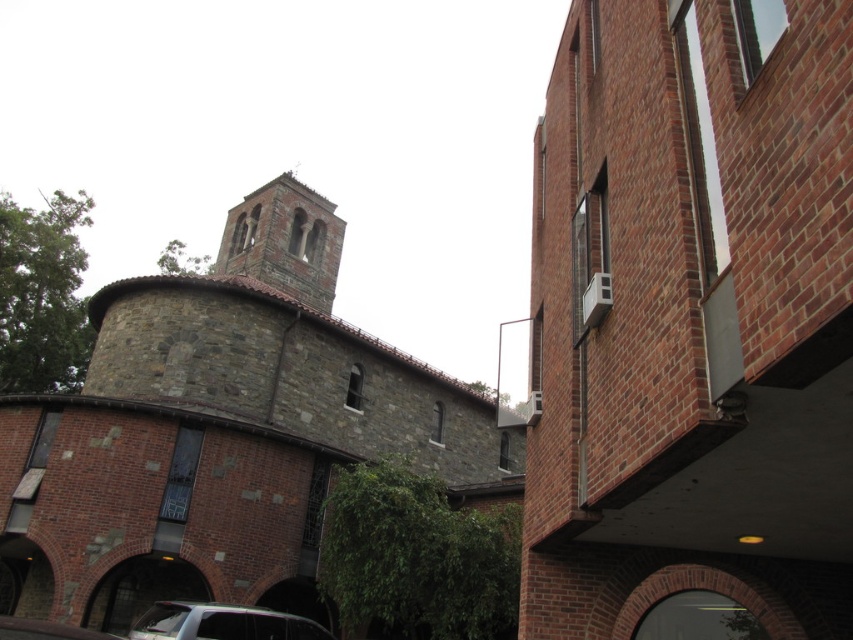
Which is behind, point (746, 429) or point (173, 346)?

The point (173, 346) is behind.

Is brick building at right wider than stone church at center?

In fact, brick building at right might be narrower than stone church at center.

What are the coordinates of `brick building at right` in the screenshot? It's located at (692, 317).

Who is more distant from viewer, (820,474) or (202,632)?

The point (202,632) is more distant.

Can you confirm if brick building at right is positioned above metallic silver car at lower left?

Indeed, brick building at right is positioned over metallic silver car at lower left.

At what (x,y) coordinates should I click in order to perform the action: click on brick building at right. Please return your answer as a coordinate pair (x, y). This screenshot has width=853, height=640. Looking at the image, I should click on (692, 317).

Is stone church at center above metallic silver car at lower left?

Yes, stone church at center is above metallic silver car at lower left.

Which is more to the left, stone church at center or metallic silver car at lower left?

Positioned to the left is metallic silver car at lower left.

You are a GUI agent. You are given a task and a screenshot of the screen. Output one action in this format:
    pyautogui.click(x=<x>, y=<y>)
    Task: Click on the stone church at center
    This screenshot has height=640, width=853.
    Given the screenshot: What is the action you would take?
    pyautogui.click(x=222, y=432)